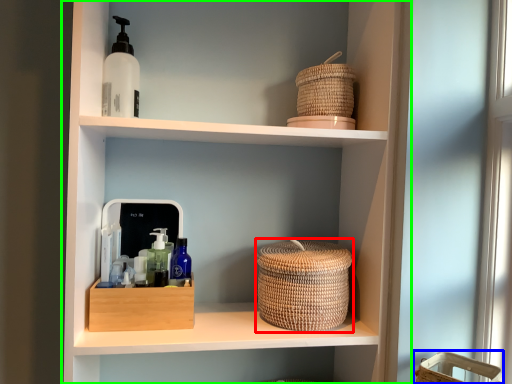
Question: Considering the real-world distances, which object is closest to basket container (highlighted by a red box)? basket (highlighted by a blue box) or shelf (highlighted by a green box).

Choices:
 (A) basket
 (B) shelf

Answer: (B)